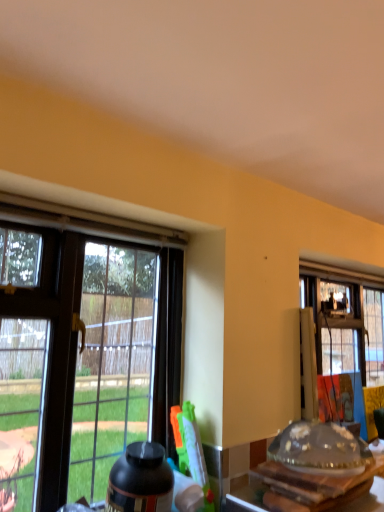
Image resolution: width=384 pixels, height=512 pixels. What do you see at coordinates (81, 351) in the screenshot? I see `transparent glass window at left` at bounding box center [81, 351].

Where is `transparent glass window at left`? transparent glass window at left is located at coordinates (81, 351).

Measure the distance between transparent glass table at lower right and camera.

They are 1.14 meters apart.

What is the approximate width of transparent glass table at lower right?

transparent glass table at lower right is 41.31 centimeters wide.

Find the location of a particular element. The width and height of the screenshot is (384, 512). black matte bottle at lower center is located at coordinates (140, 480).

Can you confirm if black matte bottle at lower center is bigger than transparent glass table at lower right?

No.

Does black matte bottle at lower center have a greater width compared to transparent glass table at lower right?

In fact, black matte bottle at lower center might be narrower than transparent glass table at lower right.

From the picture: Is black matte bottle at lower center positioned with its back to transparent glass table at lower right?

No, transparent glass table at lower right is not at the back of black matte bottle at lower center.

From the image's perspective, which is below, black matte bottle at lower center or transparent glass table at lower right?

black matte bottle at lower center, from the image's perspective.

Does transparent glass window at left lie behind transparent glass table at lower right?

No, transparent glass window at left is closer to the camera.

Considering the sizes of objects transparent glass window at left and transparent glass table at lower right in the image provided, who is bigger, transparent glass window at left or transparent glass table at lower right?

Bigger between the two is transparent glass window at left.

Consider the image. Are transparent glass window at left and transparent glass table at lower right beside each other?

No, transparent glass window at left is not touching transparent glass table at lower right.

Looking at this image, from a real-world perspective, which is physically above, transparent glass window at left or transparent glass table at lower right?

transparent glass window at left.

Considering the positions of point (169, 511) and point (76, 219), is point (169, 511) closer or farther from the camera than point (76, 219)?

Point (169, 511) is closer to the camera than point (76, 219).

From the image's perspective, would you say black matte bottle at lower center is positioned over transparent glass window at left?

No.

From a real-world perspective, is black matte bottle at lower center positioned under transparent glass window at left based on gravity?

Correct, in the physical world, black matte bottle at lower center is lower than transparent glass window at left.

Considering the sizes of transparent glass table at lower right and black matte bottle at lower center in the image, is transparent glass table at lower right wider or thinner than black matte bottle at lower center?

Clearly, transparent glass table at lower right has more width compared to black matte bottle at lower center.

Can black matte bottle at lower center be found inside transparent glass table at lower right?

No.

Are transparent glass table at lower right and black matte bottle at lower center located far from each other?

No, there isn't a large distance between transparent glass table at lower right and black matte bottle at lower center.

Does transparent glass table at lower right have a larger size compared to black matte bottle at lower center?

Yes, transparent glass table at lower right is bigger than black matte bottle at lower center.

Based on the photo, is transparent glass window at left next to black matte bottle at lower center?

No, transparent glass window at left is not next to black matte bottle at lower center.

From the image's perspective, is transparent glass window at left under black matte bottle at lower center?

No, from the image's perspective, transparent glass window at left is not below black matte bottle at lower center.

Can you confirm if transparent glass window at left is bigger than black matte bottle at lower center?

Indeed, transparent glass window at left has a larger size compared to black matte bottle at lower center.

Is transparent glass window at left in front of black matte bottle at lower center?

That is True.

Is transparent glass table at lower right at the right side of transparent glass window at left?

Correct, you'll find transparent glass table at lower right to the right of transparent glass window at left.

How distant is transparent glass table at lower right from transparent glass window at left?

The distance of transparent glass table at lower right from transparent glass window at left is 21.00 inches.

From a real-world perspective, is transparent glass table at lower right positioned over transparent glass window at left based on gravity?

No.

Would you consider transparent glass table at lower right to be distant from transparent glass window at left?

They are positioned close to each other.

Locate an element on the screen. kitchen & dining room table in front of the black matte bottle at lower center is located at coordinates (300, 488).

Identify the location of kitchen & dining room table behind the transparent glass window at left. (300, 488).

Which object lies nearer to the anchor point transparent glass table at lower right, black matte bottle at lower center or transparent glass window at left?

Based on the image, black matte bottle at lower center appears to be nearer to transparent glass table at lower right.

Based on their spatial positions, is transparent glass table at lower right or transparent glass window at left closer to black matte bottle at lower center?

Among the two, transparent glass window at left is located nearer to black matte bottle at lower center.

Which object lies further to the anchor point black matte bottle at lower center, transparent glass window at left or transparent glass table at lower right?

The object further to black matte bottle at lower center is transparent glass table at lower right.

When comparing their distances from transparent glass window at left, does black matte bottle at lower center or transparent glass table at lower right seem closer?

The object closer to transparent glass window at left is black matte bottle at lower center.

From the image, which object appears to be nearer to transparent glass table at lower right, transparent glass window at left or black matte bottle at lower center?

black matte bottle at lower center is closer to transparent glass table at lower right.

In the scene shown: Considering their positions, is transparent glass table at lower right positioned further to transparent glass window at left than black matte bottle at lower center?

Based on the image, transparent glass table at lower right appears to be further to transparent glass window at left.

Identify the location of bottle between transparent glass window at left and transparent glass table at lower right in the horizontal direction. (140, 480).